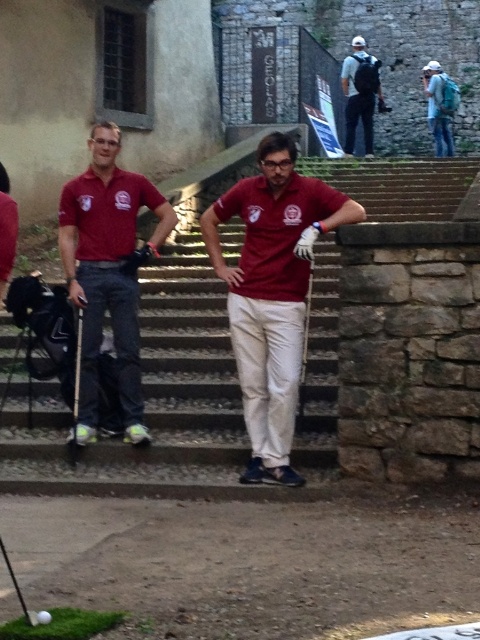
Does matte black golf club at center lie in front of white matte golf ball at center?

No, matte black golf club at center is further to the viewer.

Between matte black golf club at center and white matte golf ball at center, which one is positioned lower?

white matte golf ball at center is below.

Who is more distant from viewer, (70,440) or (48,620)?

Point (70,440)

This screenshot has height=640, width=480. I want to click on matte black golf club at center, so click(x=75, y=390).

Can you confirm if matte gray backpack at upper right is positioned below white matte golf ball at center?

No, matte gray backpack at upper right is not below white matte golf ball at center.

Which of these two, matte gray backpack at upper right or white matte golf ball at center, stands taller?

Standing taller between the two is matte gray backpack at upper right.

Identify the location of matte gray backpack at upper right. (360, 93).

Does matte khaki pants at center have a lesser width compared to matte black golf club at center?

No, matte khaki pants at center is not thinner than matte black golf club at center.

Between matte khaki pants at center and matte black golf club at center, which one is positioned lower?

matte black golf club at center

I want to click on matte khaki pants at center, so [x=273, y=292].